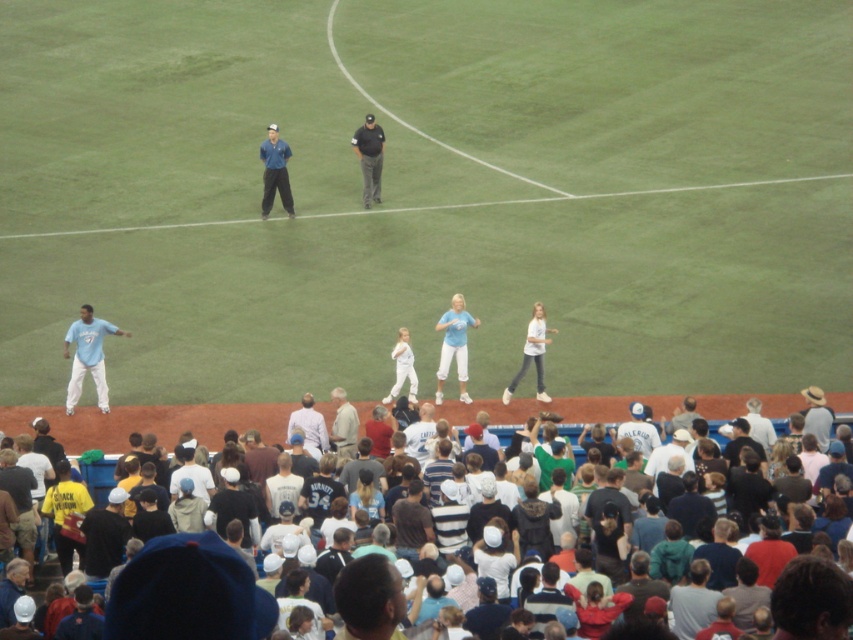
Does white matte jeans at center have a greater height compared to light brown leather jacket at center?

Indeed, white matte jeans at center has a greater height compared to light brown leather jacket at center.

What do you see at coordinates (532, 355) in the screenshot?
I see `white matte jeans at center` at bounding box center [532, 355].

The image size is (853, 640). What are the coordinates of `white matte jeans at center` in the screenshot? It's located at (532, 355).

Which is more to the right, dark gray uniform at center or light brown leather jacket at center?

Positioned to the right is light brown leather jacket at center.

Can you confirm if dark gray uniform at center is wider than light brown leather jacket at center?

Yes, dark gray uniform at center is wider than light brown leather jacket at center.

Locate an element on the screen. dark gray uniform at center is located at coordinates coord(369,157).

The width and height of the screenshot is (853, 640). In order to click on dark gray uniform at center in this screenshot , I will do `click(369, 157)`.

From the picture: Is blue fabric uniform at center taller than dark gray uniform at center?

No.

Can you confirm if blue fabric uniform at center is smaller than dark gray uniform at center?

Yes.

At what (x,y) coordinates should I click in order to perform the action: click on blue fabric uniform at center. Please return your answer as a coordinate pair (x, y). The height and width of the screenshot is (640, 853). Looking at the image, I should click on (276, 172).

Where is `blue fabric uniform at center`? Image resolution: width=853 pixels, height=640 pixels. blue fabric uniform at center is located at coordinates (276, 172).